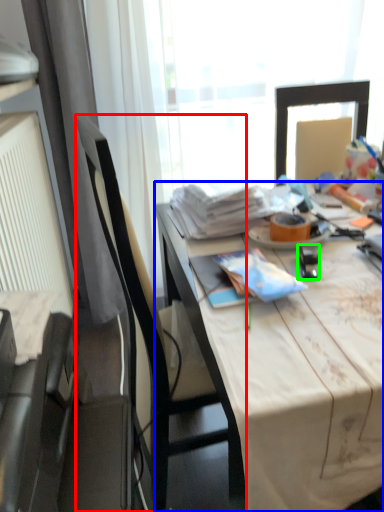
Question: Estimate the real-world distances between objects in this image. Which object is farther from chair (highlighted by a red box), desk (highlighted by a blue box) or stationery (highlighted by a green box)?

Choices:
 (A) desk
 (B) stationery

Answer: (B)